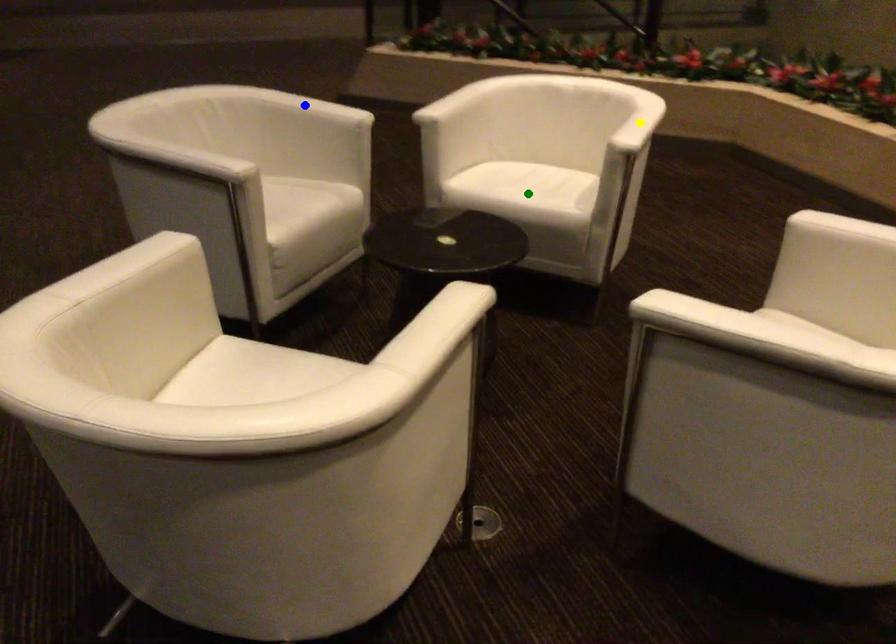
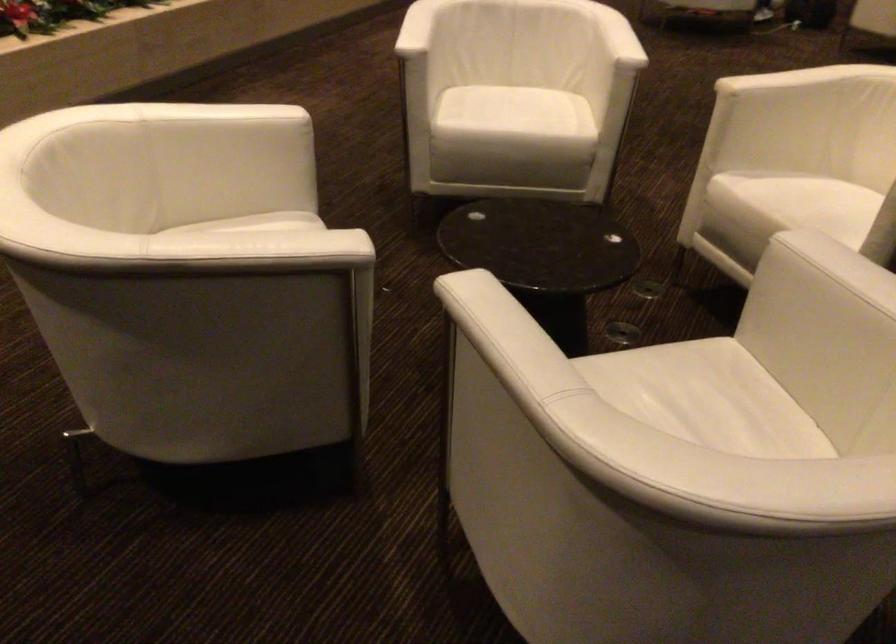
I am providing you with two images of the same scene from different viewpoints. Three points are marked in image1. Which point corresponds to a part or object that is occluded in image2?In image1, three points are marked. Which of them correspond to a part or object that is occluded in image2?Among the three points shown in image1, which one corresponds to a part or object that is no longer visible due to occlusion in image2?

yellow point, green point cannot be seen in image2.